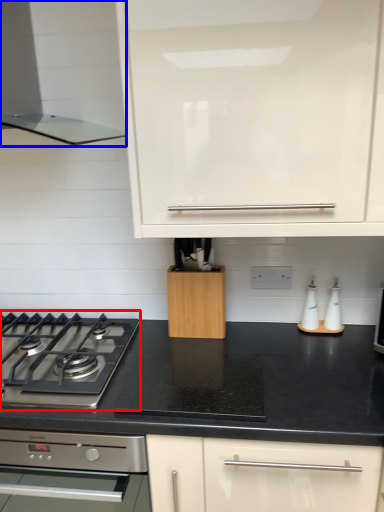
Question: Among these objects, which one is farthest to the camera, gas stove (highlighted by a red box) or home appliance (highlighted by a blue box)?

Choices:
 (A) gas stove
 (B) home appliance

Answer: (A)